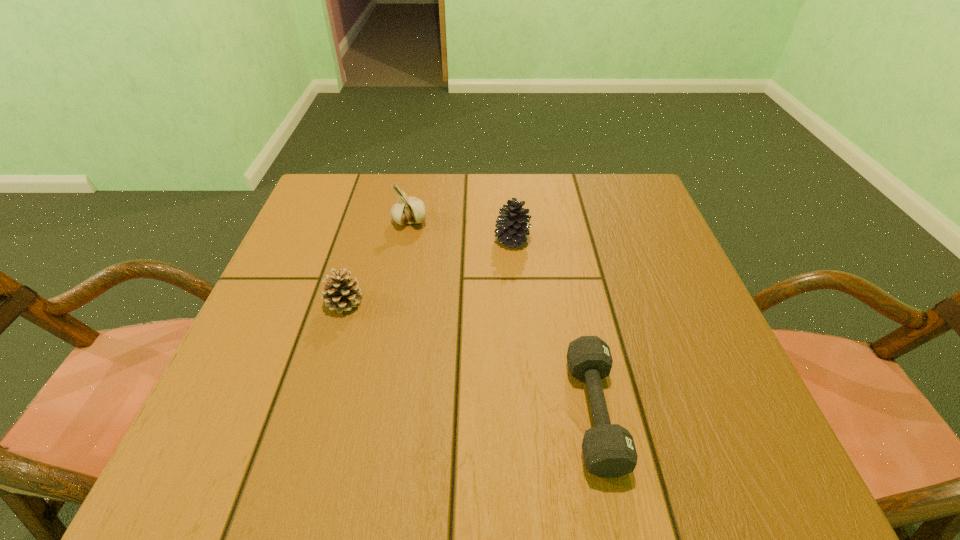
I want to click on vacant space positioned on the left of the shortest object, so click(x=429, y=413).

I want to click on object that is at the far edge, so click(x=407, y=210).

The height and width of the screenshot is (540, 960). In order to click on object at the near edge in this screenshot , I will do 608,449.

You are a GUI agent. You are given a task and a screenshot of the screen. Output one action in this format:
    pyautogui.click(x=<x>, y=<y>)
    Task: Click on the object situated at the left edge
    
    Given the screenshot: What is the action you would take?
    pyautogui.click(x=341, y=294)

Locate an element on the screen. The image size is (960, 540). vacant area at the far edge of the desktop is located at coordinates (534, 198).

Find the location of a particular element. free space at the near edge of the desktop is located at coordinates (406, 438).

The height and width of the screenshot is (540, 960). I want to click on free spot at the left edge of the desktop, so click(247, 340).

In the image, there is a desktop. Find the location of `vacant space at the right edge`. vacant space at the right edge is located at coordinates (613, 275).

The image size is (960, 540). In the image, there is a desktop. Find the location of `free space at the far left corner`. free space at the far left corner is located at coordinates (310, 197).

Find the location of `free region at the far right corner of the desktop`. free region at the far right corner of the desktop is located at coordinates (652, 204).